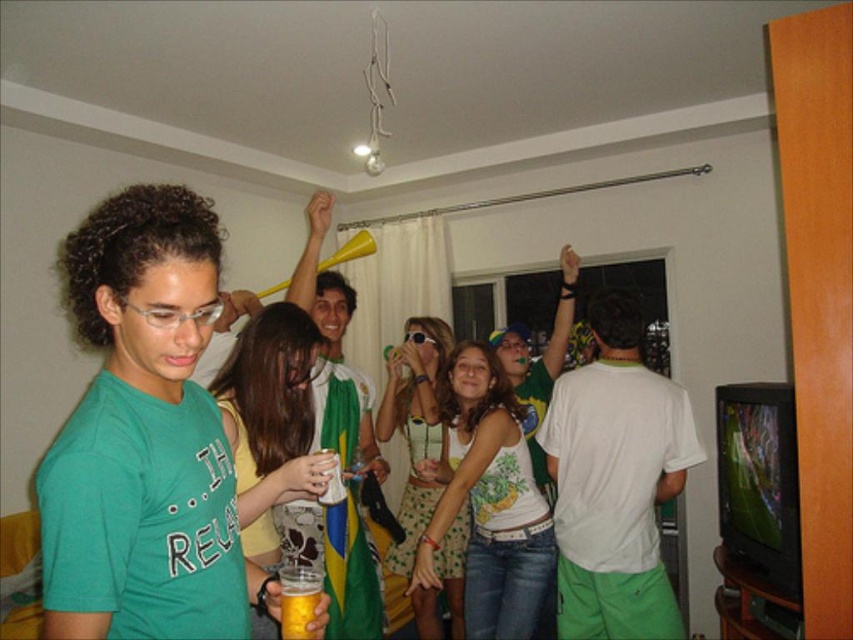
Question: Does white printed tank top at center appear under green polka dot dress at center?

Choices:
 (A) no
 (B) yes

Answer: (A)

Question: Which of the following is the farthest from the observer?

Choices:
 (A) white printed tank top at center
 (B) translucent plastic cup at center

Answer: (A)

Question: Estimate the real-world distances between objects in this image. Which object is closer to the translucent plastic cup at center?

Choices:
 (A) white printed tank top at center
 (B) translucent plastic cup at lower left
 (C) green polka dot dress at center

Answer: (B)

Question: Is translucent plastic cup at center smaller than green polka dot dress at center?

Choices:
 (A) no
 (B) yes

Answer: (B)

Question: From the image, what is the correct spatial relationship of translucent plastic cup at center in relation to green polka dot dress at center?

Choices:
 (A) above
 (B) below

Answer: (A)

Question: Which point appears closest to the camera in this image?

Choices:
 (A) (415, 589)
 (B) (456, 458)
 (C) (299, 604)

Answer: (C)